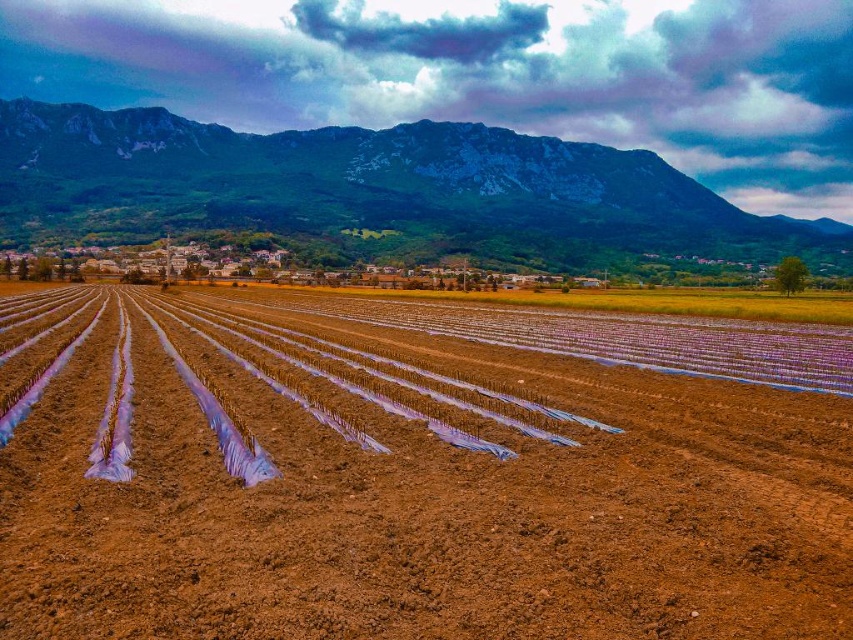
You are standing at the point labeled as point (413, 476) in the image. Looking around, you see brown soil at center. What is directly beneath your feet?

Answer: The point labeled as point (413, 476) corresponds to brown soil at center, so the brown soil at center is directly beneath your feet.

You are a farmer standing in the field and see the brown soil at center and the green textured mountain at upper center. Which object is closer to you?

The brown soil at center is closer because it is in front of the green textured mountain at upper center.